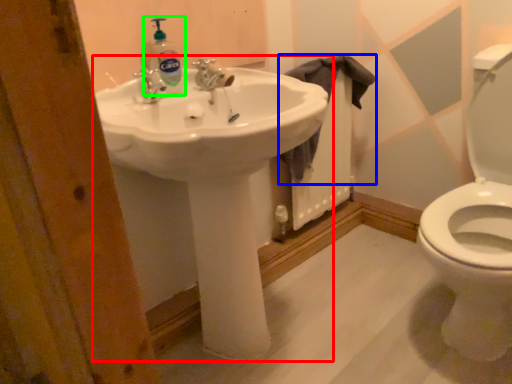
Question: Which object is positioned farthest from sink (highlighted by a red box)? Select from cloth (highlighted by a blue box) and cleaning product (highlighted by a green box).

Choices:
 (A) cloth
 (B) cleaning product

Answer: (A)